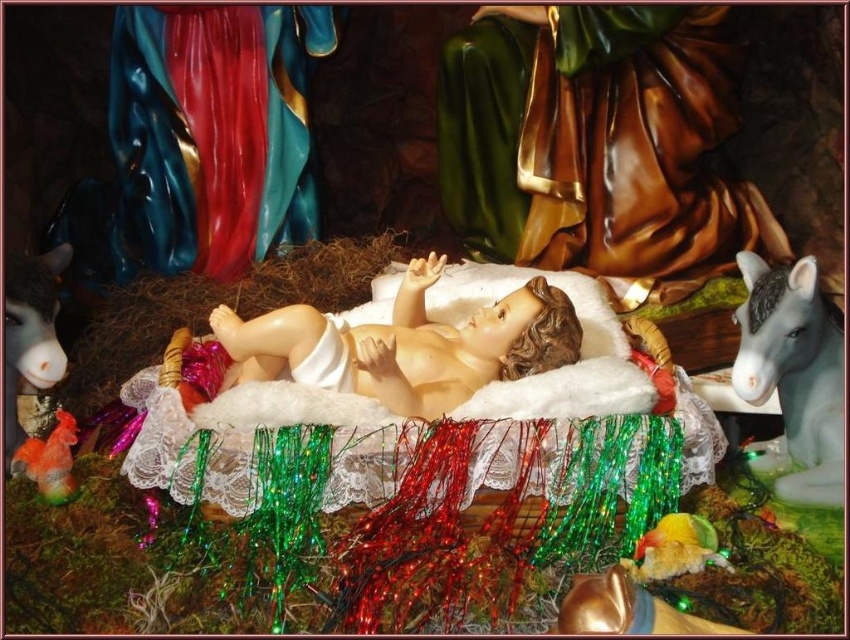
Question: Which of the following is the farthest from the observer?

Choices:
 (A) multicolored plastic parrot at lower right
 (B) brown fur stuffed animal at left

Answer: (B)

Question: Is white glossy horse at right positioned in front of brown fur stuffed animal at left?

Choices:
 (A) yes
 (B) no

Answer: (A)

Question: Which object appears closest to the camera in this image?

Choices:
 (A) multicolored plastic parrot at lower right
 (B) white glossy horse at right

Answer: (A)

Question: Which point appears farthest from the camera in this image?

Choices:
 (A) (782, 330)
 (B) (17, 337)

Answer: (B)

Question: Is white glossy horse at right smaller than multicolored plastic parrot at lower right?

Choices:
 (A) no
 (B) yes

Answer: (A)

Question: Can you confirm if white glossy horse at right is thinner than brown fur stuffed animal at left?

Choices:
 (A) yes
 (B) no

Answer: (A)